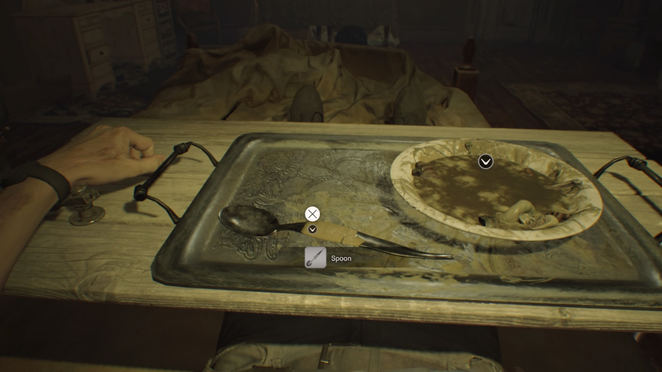
Image resolution: width=662 pixels, height=372 pixels. Identify the location of crumpled blurry bed sheets. (236, 83), (355, 97).